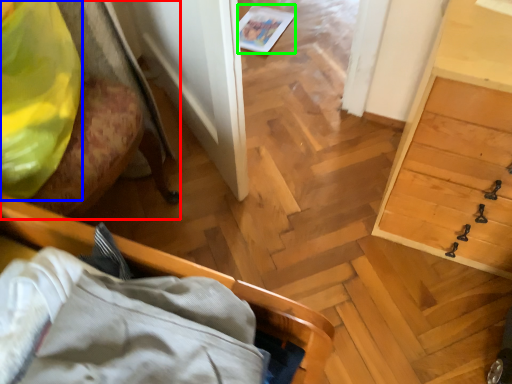
Question: Which is nearer to the furniture (highlighted by a red box)? clothing (highlighted by a blue box) or magazine (highlighted by a green box).

Choices:
 (A) clothing
 (B) magazine

Answer: (A)